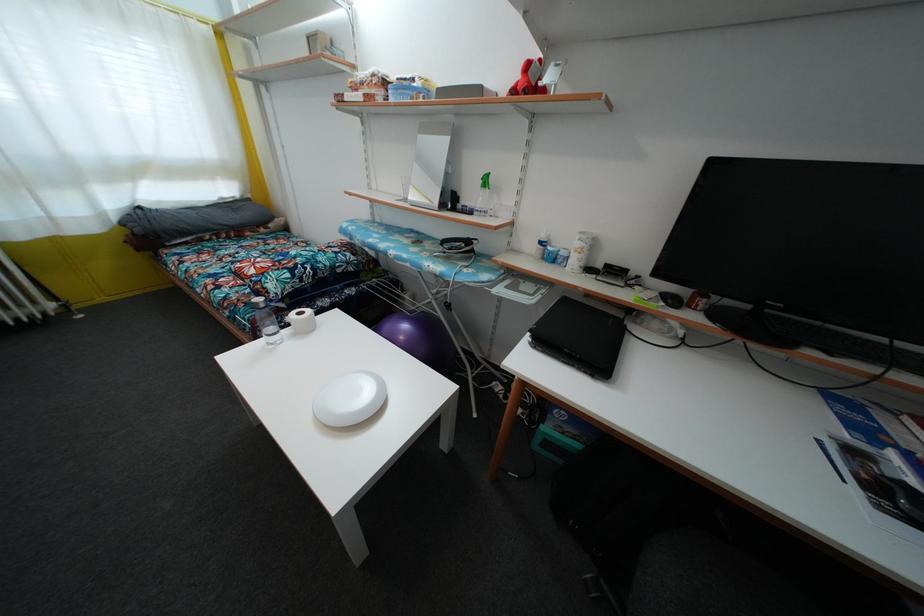
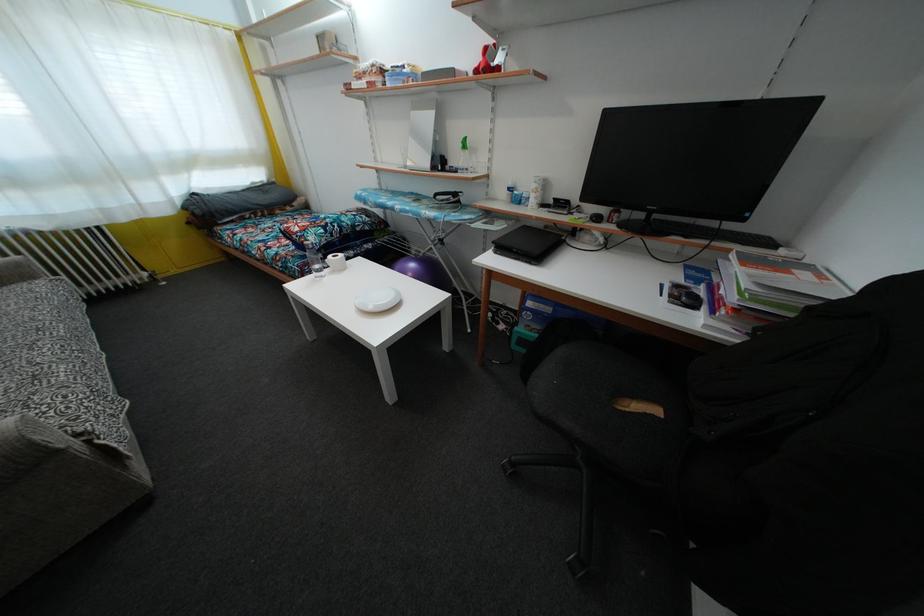
Find the pixel in the second image that matches point 312,318 in the first image.

(345, 262)